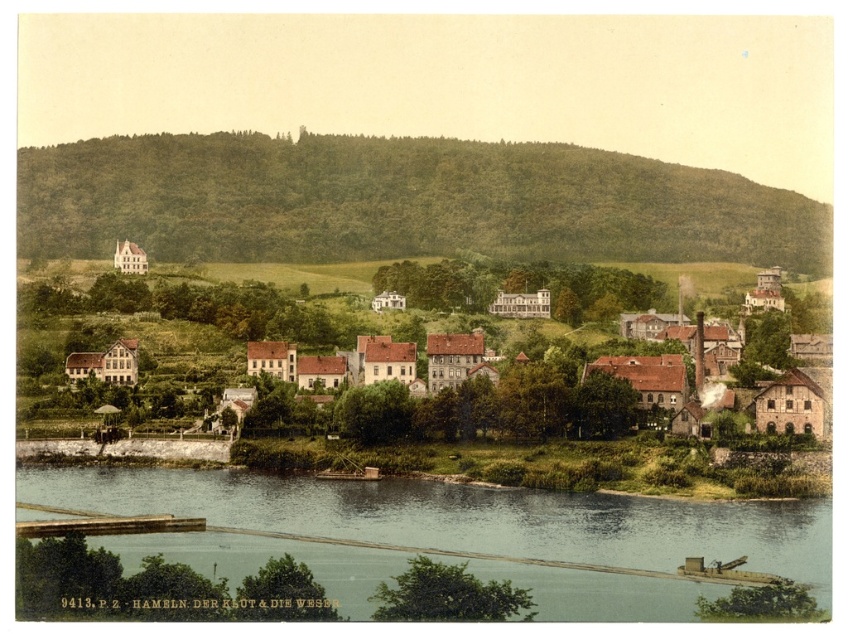
You are a tourist in Hameln, Germany, and you want to take a photo that includes both the green textured hillside at upper center and the clear water at lower center. Based on their positions, which object will appear closer to the camera in your photo?

The clear water at lower center will appear closer to the camera because it is positioned behind the green textured hillside at upper center, meaning the hillside is in the foreground while the water is further back in the background.